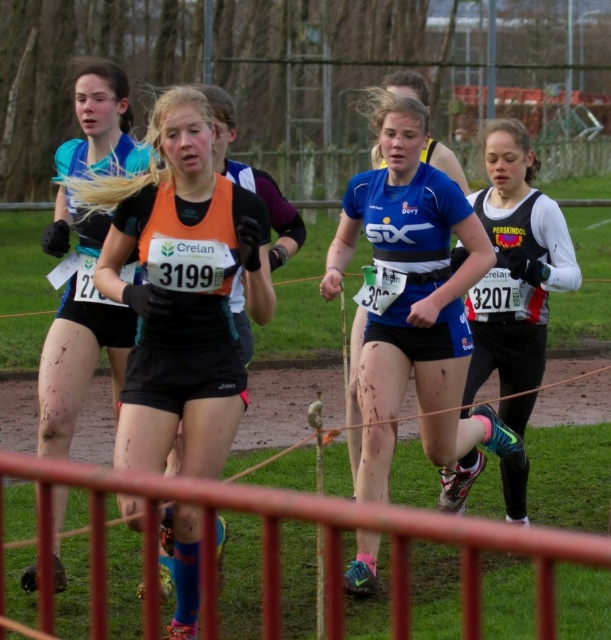
You are a course marshal at the cross country race and need to ensure that the orange matte vest at center and the black matte running suit at right are within the 2 meter width of the race path. Based on their positions, can both fit side by side within the path without overlapping?

The orange matte vest at center might be wider than black matte running suit at right, so there is uncertainty if both can fit side by side within the 2 meter width of the race path without overlapping. Further measurement is needed.

You are a race official trying to locate the runner wearing the blue matte jersey at center. According to the coordinate system where the bottom left corner is the origin, can you confirm if the jersey is located in the upper half of the image?

The blue matte jersey at center is at coordinate point [415,285]. Since the y coordinate 0.681 is above 0.5, the jersey is in the upper half of the image.